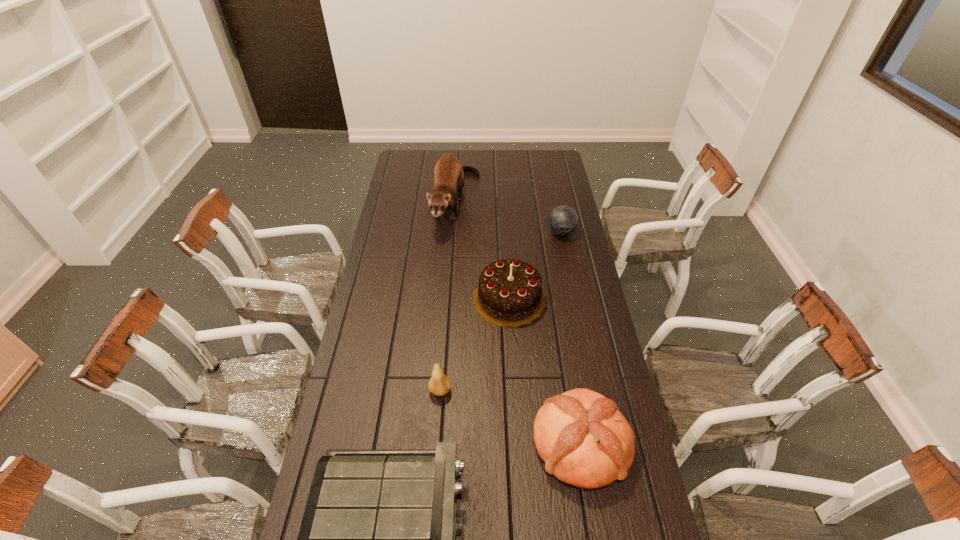
Locate an element on the screen. vacant space located 0.260m on the front of the pear is located at coordinates (433, 487).

At what (x,y) coordinates should I click in order to perform the action: click on object located in the far edge section of the desktop. Please return your answer as a coordinate pair (x, y). This screenshot has width=960, height=540. Looking at the image, I should click on (449, 176).

Where is `bread that is positioned at the right edge`? This screenshot has width=960, height=540. bread that is positioned at the right edge is located at coordinates (584, 440).

The image size is (960, 540). Find the location of `bowling ball located in the right edge section of the desktop`. bowling ball located in the right edge section of the desktop is located at coordinates (563, 220).

Where is `vacant region at the far edge of the desktop`? The image size is (960, 540). vacant region at the far edge of the desktop is located at coordinates (514, 152).

In the image, there is a desktop. Find the location of `vacant space at the left edge`. vacant space at the left edge is located at coordinates (412, 188).

In the image, there is a desktop. What are the coordinates of `blank space at the right edge` in the screenshot? It's located at (x=566, y=264).

Where is `free space at the far left corner of the desktop`? This screenshot has width=960, height=540. free space at the far left corner of the desktop is located at coordinates (422, 151).

I want to click on vacant area between the pear and the ferret, so click(448, 297).

The image size is (960, 540). I want to click on empty location between the pear and the birthday cake, so click(x=474, y=345).